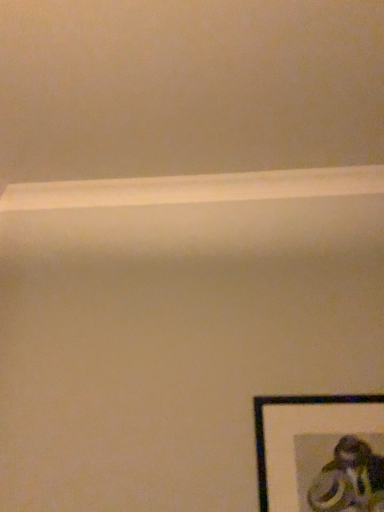
The width and height of the screenshot is (384, 512). What do you see at coordinates (320, 453) in the screenshot?
I see `black matte picture frame at lower right` at bounding box center [320, 453].

This screenshot has width=384, height=512. In order to click on black matte picture frame at lower right in this screenshot , I will do `click(320, 453)`.

This screenshot has width=384, height=512. In order to click on black matte picture frame at lower right in this screenshot , I will do `click(320, 453)`.